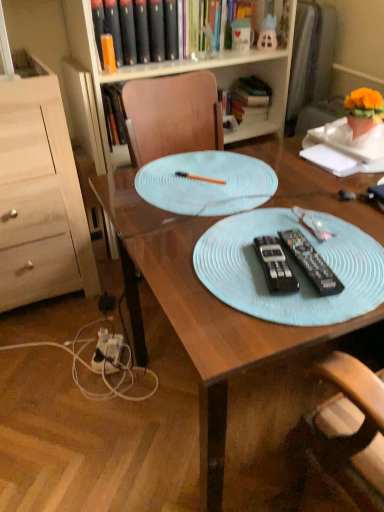
Where is `vacant space to the left of black plastic remote control at center, the 1th remote control when ordered from right to left`? Image resolution: width=384 pixels, height=512 pixels. vacant space to the left of black plastic remote control at center, the 1th remote control when ordered from right to left is located at coordinates point(215,270).